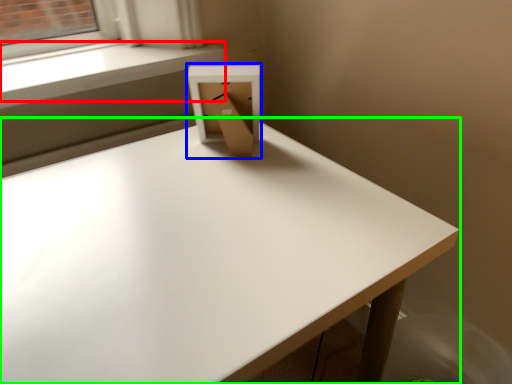
Question: Which object is positioned farthest from window sill (highlighted by a red box)? Select from cardboard box (highlighted by a blue box) and table (highlighted by a green box).

Choices:
 (A) cardboard box
 (B) table

Answer: (B)